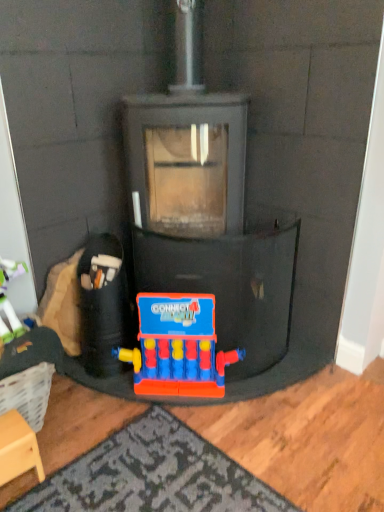
Question: Are plastic connect four game at center, the 2th toy when ordered from left to right, and rubberized plastic toy at lower center, acting as the first toy starting from the left, making contact?

Choices:
 (A) no
 (B) yes

Answer: (A)

Question: Considering the relative sizes of plastic connect four game at center, the 2th toy when ordered from left to right, and rubberized plastic toy at lower center, the second toy from the right, in the image provided, is plastic connect four game at center, the 2th toy when ordered from left to right, bigger than rubberized plastic toy at lower center, the second toy from the right,?

Choices:
 (A) no
 (B) yes

Answer: (A)

Question: Can you confirm if plastic connect four game at center, the 1th toy when ordered from right to left, is wider than rubberized plastic toy at lower center, acting as the first toy starting from the left?

Choices:
 (A) yes
 (B) no

Answer: (B)

Question: From the image's perspective, would you say plastic connect four game at center, the 2th toy when ordered from left to right, is positioned over rubberized plastic toy at lower center, the second toy from the right?

Choices:
 (A) yes
 (B) no

Answer: (B)

Question: Is plastic connect four game at center, the 1th toy when ordered from right to left, further to the viewer compared to rubberized plastic toy at lower center, the second toy from the right?

Choices:
 (A) no
 (B) yes

Answer: (A)

Question: Is plastic connect four game at center, the 2th toy when ordered from left to right, taller or shorter than rubberized plastic toy at lower center, acting as the first toy starting from the left?

Choices:
 (A) short
 (B) tall

Answer: (A)

Question: In the image, is plastic connect four game at center, the 1th toy when ordered from right to left, positioned in front of or behind rubberized plastic toy at lower center, acting as the first toy starting from the left?

Choices:
 (A) behind
 (B) front

Answer: (B)

Question: From the image's perspective, is plastic connect four game at center, the 2th toy when ordered from left to right, above or below rubberized plastic toy at lower center, the second toy from the right?

Choices:
 (A) below
 (B) above

Answer: (A)

Question: In the image, is plastic connect four game at center, the 2th toy when ordered from left to right, on the left side or the right side of rubberized plastic toy at lower center, acting as the first toy starting from the left?

Choices:
 (A) left
 (B) right

Answer: (B)

Question: Based on their positions, is plastic connect four game at center, the 1th toy when ordered from right to left, located to the left or right of wooden stool at lower left?

Choices:
 (A) left
 (B) right

Answer: (B)

Question: Considering the positions of point (213, 312) and point (26, 432), is point (213, 312) closer or farther from the camera than point (26, 432)?

Choices:
 (A) farther
 (B) closer

Answer: (A)

Question: Looking at the image, does plastic connect four game at center, the 1th toy when ordered from right to left, seem bigger or smaller compared to wooden stool at lower left?

Choices:
 (A) big
 (B) small

Answer: (A)

Question: Is plastic connect four game at center, the 2th toy when ordered from left to right, inside the boundaries of wooden stool at lower left, or outside?

Choices:
 (A) inside
 (B) outside

Answer: (B)

Question: In the image, is wooden stool at lower left positioned in front of or behind plastic connect four game at center, the 1th toy when ordered from right to left?

Choices:
 (A) front
 (B) behind

Answer: (A)

Question: Looking at their shapes, would you say wooden stool at lower left is wider or thinner than plastic connect four game at center, the 2th toy when ordered from left to right?

Choices:
 (A) wide
 (B) thin

Answer: (A)